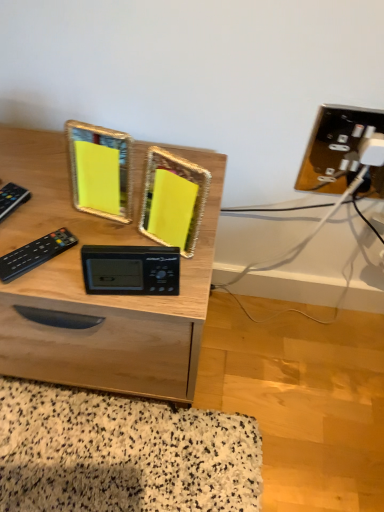
Question: Is wooden desk at center taller or shorter than black plastic remote at left, the 1th control viewed from the left?

Choices:
 (A) tall
 (B) short

Answer: (A)

Question: From a real-world perspective, is wooden desk at center physically located above or below black plastic remote at left, which ranks as the second control in right-to-left order?

Choices:
 (A) below
 (B) above

Answer: (A)

Question: Which of these objects is positioned closest to the wooden desk at center?

Choices:
 (A) black plastic remote at left, which ranks as the second control in right-to-left order
 (B) black plastic remote at left, the first control viewed from the right
 (C) black plastic clock at center

Answer: (C)

Question: Which is nearer to the black plastic clock at center?

Choices:
 (A) wooden desk at center
 (B) black plastic remote at left, arranged as the second control when viewed from the left
 (C) black plastic remote at left, which ranks as the second control in right-to-left order

Answer: (B)